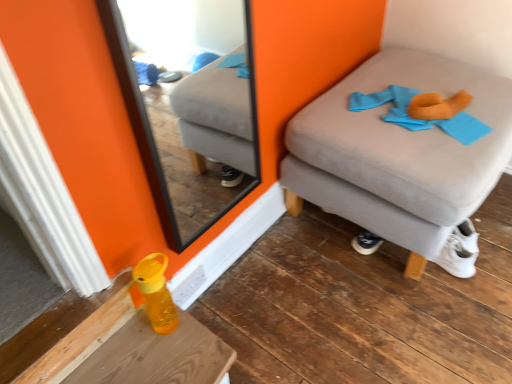
Question: From a real-world perspective, relative to suede ottoman at right, is wooden table at lower left vertically above or below?

Choices:
 (A) above
 (B) below

Answer: (B)

Question: Considering the positions of point (53, 375) and point (433, 210), is point (53, 375) closer or farther from the camera than point (433, 210)?

Choices:
 (A) closer
 (B) farther

Answer: (A)

Question: Which object is the closest to the black-framed mirror at center?

Choices:
 (A) suede ottoman at right
 (B) wooden table at lower left
 (C) translucent yellow bottle at lower left
 (D) blue fabric at upper right

Answer: (A)

Question: Estimate the real-world distances between objects in this image. Which object is closer to the wooden table at lower left?

Choices:
 (A) black-framed mirror at center
 (B) blue fabric at upper right
 (C) translucent yellow bottle at lower left
 (D) suede ottoman at right

Answer: (C)